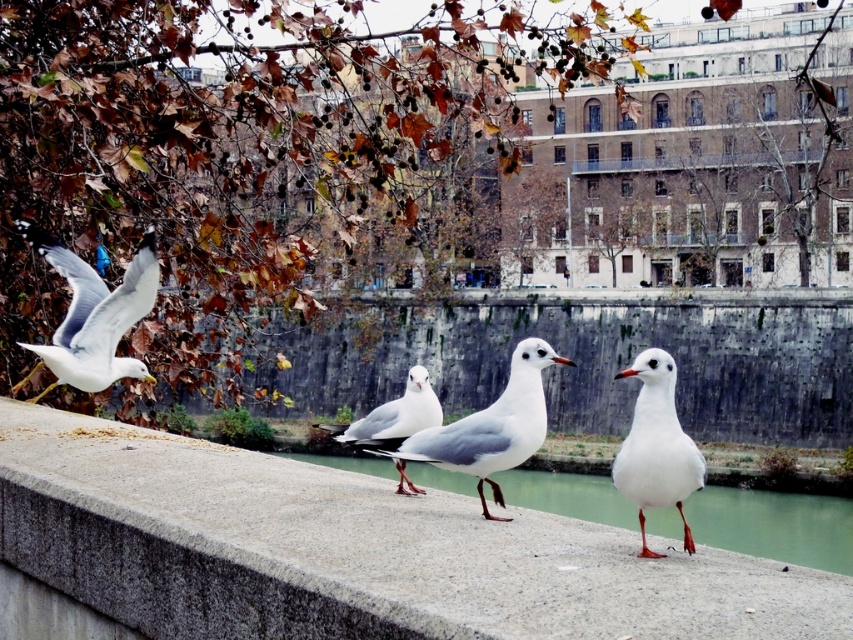
You are standing at the point labeled as point (421, 422) and want to walk to the point labeled as point (444, 636). Which direction should you face to move towards your destination?

You should face towards the direction away from the camera because point (444, 636) is closer to the camera than point (421, 422).

You are a photographer trying to capture the white matte seagull at center and the gray concrete at center in the same frame. Based on their heights, which one will appear closer to the camera in the photo?

The white matte seagull at center will appear closer to the camera because it is taller than the gray concrete at center, making it visually more prominent in the frame.

You are a bird watcher observing the scene. You notice the gray concrete at center and the white matte seagull at center. Which object is positioned higher in the image?

The gray concrete at center is positioned higher than the white matte seagull at center.